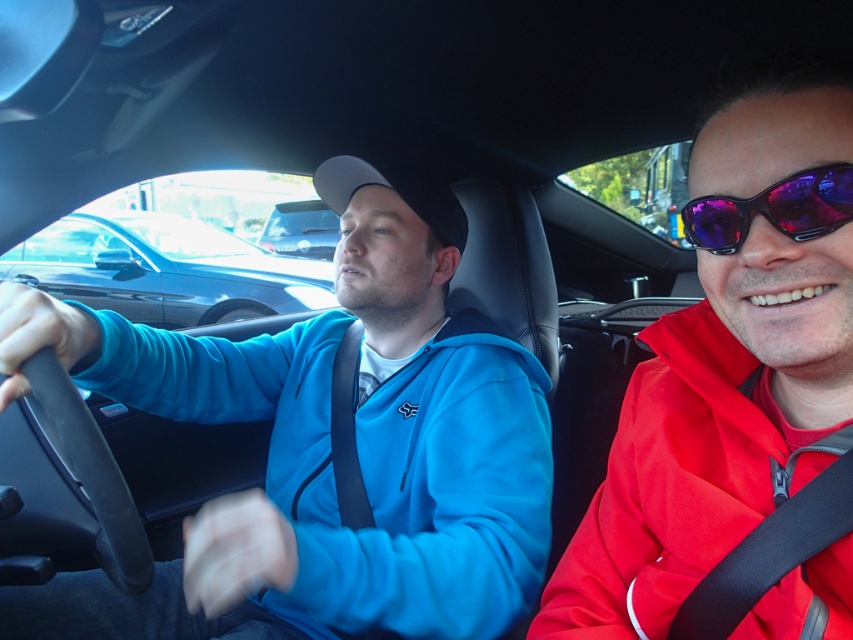
Question: Among these objects, which one is farthest from the camera?

Choices:
 (A) purple reflective sunglasses at right
 (B) shiny black sedan at left

Answer: (B)

Question: Considering the real-world distances, which object is farthest from the purple reflective sunglasses at right?

Choices:
 (A) shiny black car at center
 (B) black matte steering wheel at left

Answer: (A)

Question: Does shiny black sedan at left have a greater width compared to purple reflective sunglasses at right?

Choices:
 (A) no
 (B) yes

Answer: (B)

Question: Is the position of shiny black sedan at left more distant than that of black matte steering wheel at left?

Choices:
 (A) no
 (B) yes

Answer: (B)

Question: In this image, where is shiny purple sunglasses at center located relative to black matte steering wheel at left?

Choices:
 (A) left
 (B) right

Answer: (B)

Question: Which point appears farthest from the camera in this image?

Choices:
 (A) (13, 349)
 (B) (727, 211)
 (C) (126, 499)

Answer: (C)